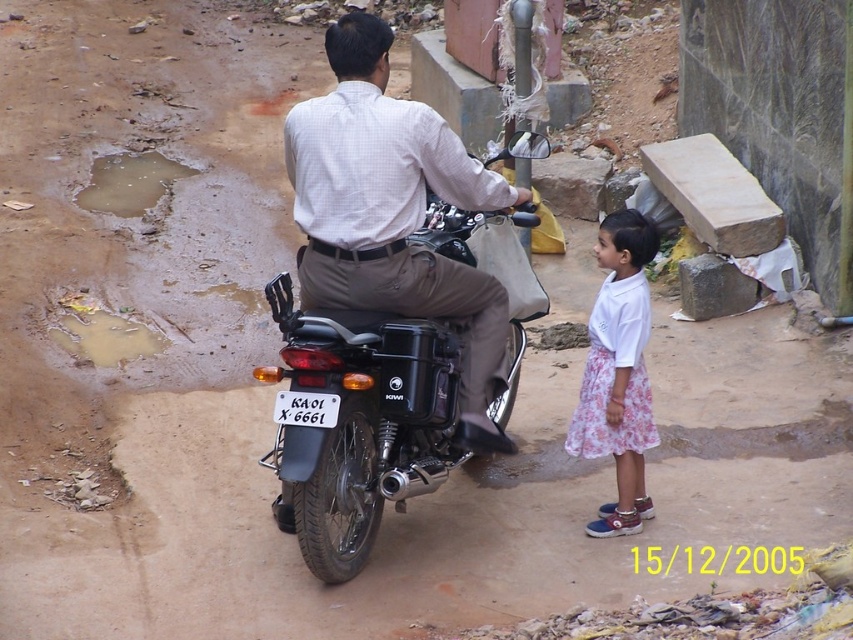
You are a delivery person on a motorcycle. You need to place a package on the ground between the white floral skirt at lower right and the white plastic license plate at center. Can you estimate the space available for placing the package?

The distance between the white floral skirt at lower right and the white plastic license plate at center is 1.38 meters, so there is sufficient space to place the package between them.

You are a delivery person needing to pass through the narrow path between the black matte motorcycle at center and the white floral skirt at lower right. The path is 1.2 meters wide. Can your 1.1 meter wide delivery cart fit through?

The black matte motorcycle at center might be wider than white floral skirt at lower right. Since the path is 1.2 meters wide and your cart is 1.1 meters wide, it might fit, but there could be little space left depending on the motorcycle width.